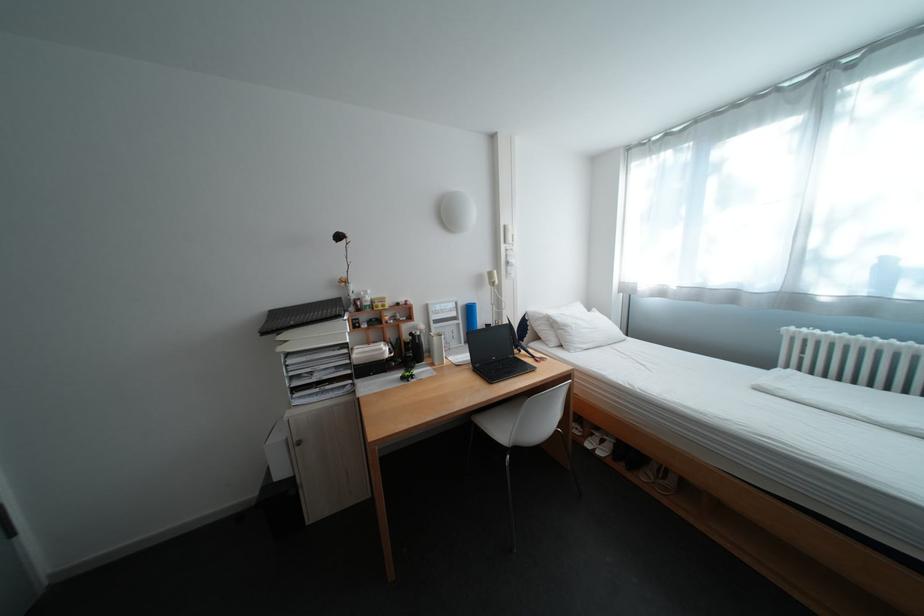
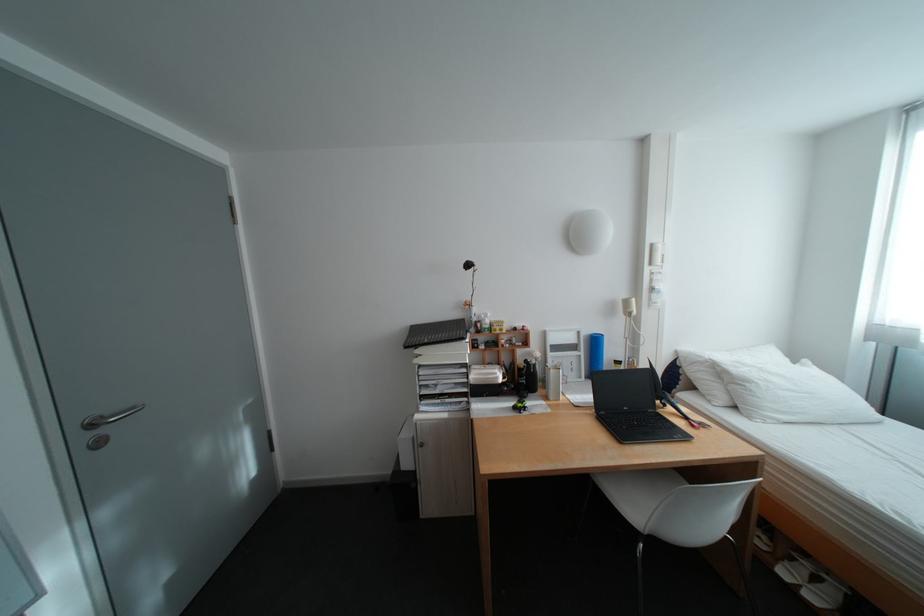
Locate, in the second image, the point that corresponds to point 488,424 in the first image.

(606, 483)